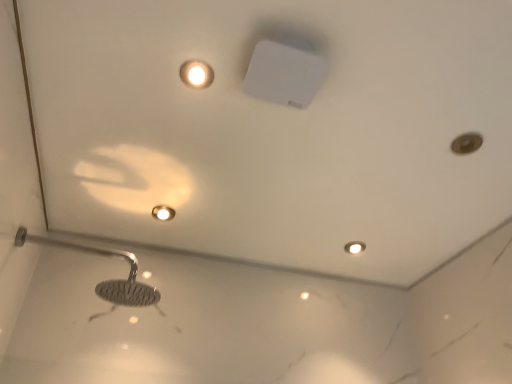
Question: Is matte white light fixture at bottom right not inside polished chrome shower head at lower left?

Choices:
 (A) no
 (B) yes

Answer: (B)

Question: Does matte white light fixture at bottom right have a lesser height compared to polished chrome shower head at lower left?

Choices:
 (A) yes
 (B) no

Answer: (A)

Question: Does matte white light fixture at bottom right come behind polished chrome shower head at lower left?

Choices:
 (A) no
 (B) yes

Answer: (B)

Question: From a real-world perspective, is matte white light fixture at bottom right positioned under polished chrome shower head at lower left based on gravity?

Choices:
 (A) no
 (B) yes

Answer: (A)

Question: Is matte white light fixture at bottom right at the right side of polished chrome shower head at lower left?

Choices:
 (A) yes
 (B) no

Answer: (A)

Question: Does matte white light fixture at bottom right turn towards polished chrome shower head at lower left?

Choices:
 (A) yes
 (B) no

Answer: (B)

Question: Does polished chrome shower head at lower left appear on the right side of matte gold droplight at upper center?

Choices:
 (A) no
 (B) yes

Answer: (A)

Question: Is the position of polished chrome shower head at lower left less distant than that of matte gold droplight at upper center?

Choices:
 (A) no
 (B) yes

Answer: (B)

Question: Is polished chrome shower head at lower left next to matte gold droplight at upper center and touching it?

Choices:
 (A) no
 (B) yes

Answer: (A)

Question: From a real-world perspective, is polished chrome shower head at lower left positioned over matte gold droplight at upper center based on gravity?

Choices:
 (A) no
 (B) yes

Answer: (A)

Question: Considering the relative sizes of polished chrome shower head at lower left and matte gold droplight at upper center in the image provided, is polished chrome shower head at lower left bigger than matte gold droplight at upper center?

Choices:
 (A) no
 (B) yes

Answer: (B)

Question: Does polished chrome shower head at lower left have a greater height compared to matte gold droplight at upper center?

Choices:
 (A) no
 (B) yes

Answer: (B)

Question: Can you confirm if matte gold droplight at upper center is shorter than polished chrome shower head at lower left?

Choices:
 (A) no
 (B) yes

Answer: (B)